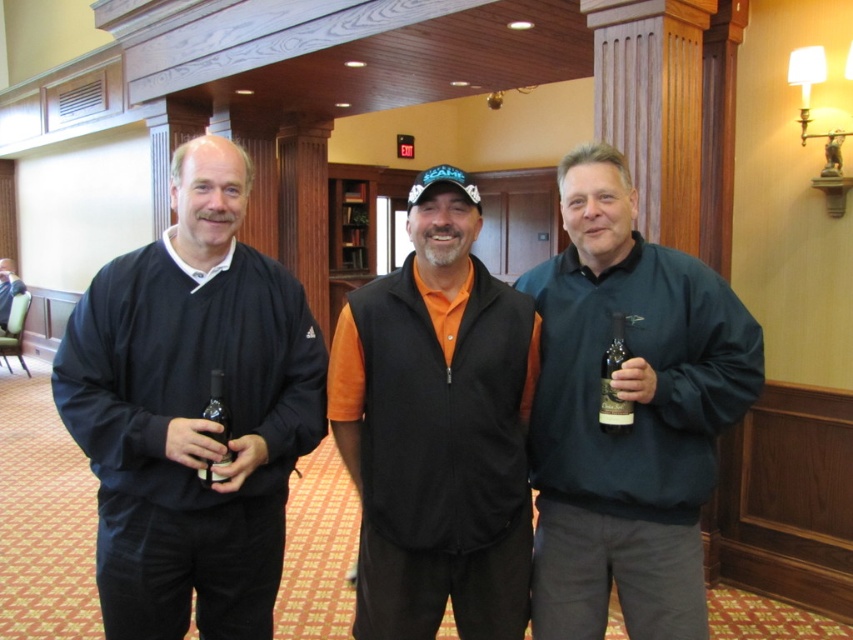
You are a photographer positioned in front of the three people. You want to take a photo that includes both the dark green sweater at center and the translucent glass bottle at center. Which object will appear closer to you in the photo?

The dark green sweater at center will appear closer to you in the photo because it is further to the viewer than the translucent glass bottle at center.

You are standing in the lobby and want to move from point A to point B. Point A is at coordinate point (241, 524) and point B is at coordinate point (621, 355). Which point is closer to you?

Point A at coordinate point (241, 524) is closer to you because it is further to the viewer than point B at coordinate point (621, 355).